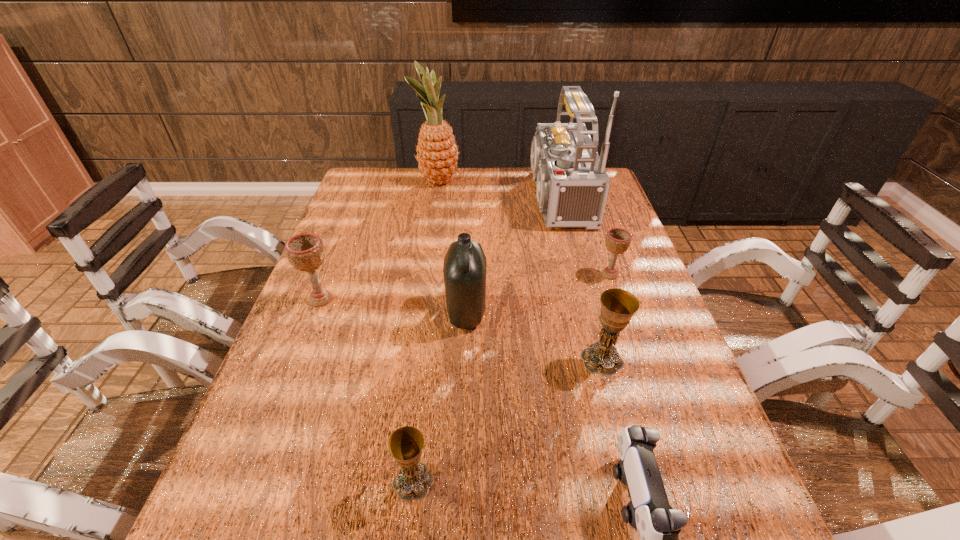
Where is `pineapple that is at the far edge`? pineapple that is at the far edge is located at coordinates 437,153.

The image size is (960, 540). What are the coordinates of `radio receiver located in the far edge section of the desktop` in the screenshot? It's located at (572, 184).

You are a GUI agent. You are given a task and a screenshot of the screen. Output one action in this format:
    pyautogui.click(x=<x>, y=<y>)
    Task: Click on the object present at the left edge
    
    Given the screenshot: What is the action you would take?
    pyautogui.click(x=305, y=252)

The width and height of the screenshot is (960, 540). I want to click on radio receiver present at the right edge, so click(x=572, y=184).

Find the location of a particular element. object at the far right corner is located at coordinates (572, 184).

Image resolution: width=960 pixels, height=540 pixels. What are the coordinates of `free space at the far edge of the desktop` in the screenshot? It's located at (513, 180).

The width and height of the screenshot is (960, 540). In order to click on free space at the left edge of the desktop in this screenshot , I will do `click(379, 232)`.

Find the location of a particular element. This screenshot has width=960, height=540. vacant space at the right edge of the desktop is located at coordinates tap(605, 246).

In the image, there is a desktop. In order to click on vacant space at the far left corner in this screenshot , I will do `click(357, 195)`.

I want to click on vacant area between the left beige chalice and the second chalice from right to left, so click(462, 329).